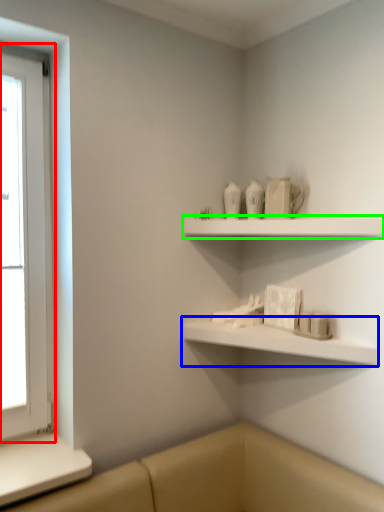
Question: Which is farther away from window (highlighted by a red box)? shelf (highlighted by a blue box) or shelf (highlighted by a green box)?

Choices:
 (A) shelf
 (B) shelf

Answer: (A)